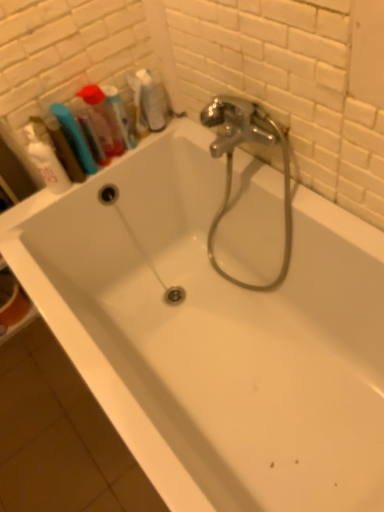
Question: Is white matte shaving cream at upper left positioned beyond the bounds of translucent plastic mouthwash at upper left, which is counted as the second mouthwash, starting from the left?

Choices:
 (A) no
 (B) yes

Answer: (B)

Question: Is white matte shaving cream at upper left positioned in front of translucent plastic mouthwash at upper left, which is counted as the second mouthwash, starting from the left?

Choices:
 (A) no
 (B) yes

Answer: (B)

Question: Is translucent plastic mouthwash at upper left, which is counted as the second mouthwash, starting from the left, surrounded by white matte shaving cream at upper left?

Choices:
 (A) yes
 (B) no

Answer: (B)

Question: Is white matte shaving cream at upper left placed right next to translucent plastic mouthwash at upper left, the 2th mouthwash when ordered from right to left?

Choices:
 (A) no
 (B) yes

Answer: (A)

Question: From the image's perspective, is white matte shaving cream at upper left below translucent plastic mouthwash at upper left, which is counted as the second mouthwash, starting from the left?

Choices:
 (A) yes
 (B) no

Answer: (A)

Question: From a real-world perspective, is translucent plastic mouthwash at upper left, the 2th mouthwash when ordered from right to left, above or below translucent plastic mouthwash at upper left, which appears as the 3th mouthwash when viewed from the left?

Choices:
 (A) above
 (B) below

Answer: (A)

Question: From their relative heights in the image, would you say translucent plastic mouthwash at upper left, the 2th mouthwash when ordered from right to left, is taller or shorter than translucent plastic mouthwash at upper left, which appears as the 3th mouthwash when viewed from the left?

Choices:
 (A) short
 (B) tall

Answer: (B)

Question: From the image's perspective, is translucent plastic mouthwash at upper left, the 2th mouthwash when ordered from right to left, located above or below translucent plastic mouthwash at upper left, placed as the 1th mouthwash when sorted from right to left?

Choices:
 (A) below
 (B) above

Answer: (A)

Question: Relative to translucent plastic mouthwash at upper left, placed as the 1th mouthwash when sorted from right to left, is translucent plastic mouthwash at upper left, the 2th mouthwash when ordered from right to left, in front or behind?

Choices:
 (A) behind
 (B) front

Answer: (B)

Question: Based on their sizes in the image, would you say translucent plastic mouthwash at upper left, the first mouthwash when ordered from left to right, is bigger or smaller than white matte shaving cream at upper left?

Choices:
 (A) big
 (B) small

Answer: (B)

Question: Is point (56, 142) closer or farther from the camera than point (46, 177)?

Choices:
 (A) farther
 (B) closer

Answer: (B)

Question: In terms of height, does translucent plastic mouthwash at upper left, the first mouthwash when ordered from left to right, look taller or shorter compared to white matte shaving cream at upper left?

Choices:
 (A) short
 (B) tall

Answer: (A)

Question: From a real-world perspective, relative to white matte shaving cream at upper left, is translucent plastic mouthwash at upper left, the first mouthwash when ordered from left to right, vertically above or below?

Choices:
 (A) above
 (B) below

Answer: (B)

Question: In the image, is translucent plastic container at upper left positioned in front of or behind translucent plastic mouthwash at upper left, placed as the 1th mouthwash when sorted from right to left?

Choices:
 (A) behind
 (B) front

Answer: (B)

Question: Considering the positions of translucent plastic container at upper left and translucent plastic mouthwash at upper left, which appears as the 3th mouthwash when viewed from the left, in the image, is translucent plastic container at upper left wider or thinner than translucent plastic mouthwash at upper left, which appears as the 3th mouthwash when viewed from the left,?

Choices:
 (A) thin
 (B) wide

Answer: (A)